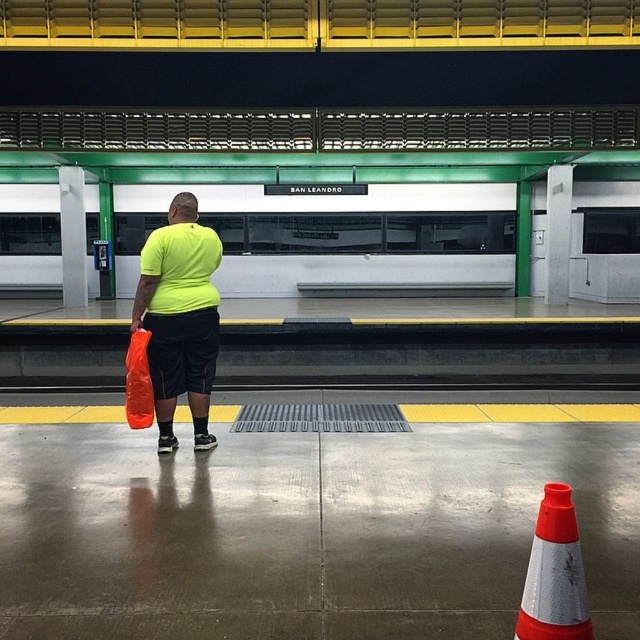
Question: Which object is closer to the camera taking this photo?

Choices:
 (A) orange reflective cone at lower right
 (B) neon yellow t-shirt at center
 (C) green matte subway at center

Answer: (A)

Question: Which point is farther from the camera taking this photo?

Choices:
 (A) (300, 250)
 (B) (145, 356)
 (C) (211, 237)

Answer: (A)

Question: Does green matte subway at center appear on the right side of orange matte shopping bag at lower left?

Choices:
 (A) no
 (B) yes

Answer: (B)

Question: In this image, where is neon yellow t-shirt at center located relative to orange matte shopping bag at lower left?

Choices:
 (A) below
 (B) above

Answer: (B)

Question: Can you confirm if neon yellow t-shirt at center is wider than orange matte shopping bag at lower left?

Choices:
 (A) yes
 (B) no

Answer: (A)

Question: Based on their relative distances, which object is farther from the green matte subway at center?

Choices:
 (A) orange matte shopping bag at lower left
 (B) neon yellow t-shirt at center
 (C) orange reflective cone at lower right

Answer: (C)